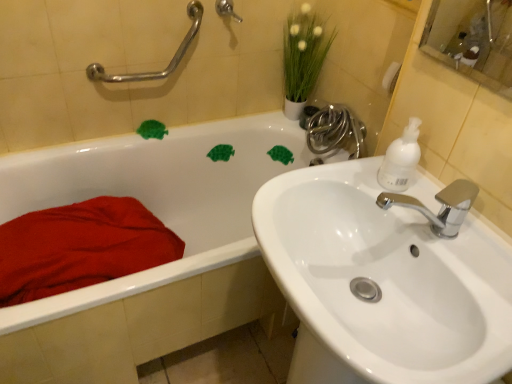
Describe the element at coordinates (382, 283) in the screenshot. I see `white glossy sink at right` at that location.

Identify the location of brushed metal shower handle at upper center, which is the first shower in right-to-left order. (226, 9).

Image resolution: width=512 pixels, height=384 pixels. I want to click on shiny chrome faucet at upper right, so click(x=335, y=131).

Which of these two, white glossy sink at right or red cotton blanket at lower left, is thinner?

With smaller width is red cotton blanket at lower left.

Is white glossy sink at right taller or shorter than red cotton blanket at lower left?

white glossy sink at right is taller than red cotton blanket at lower left.

How many degrees apart are the facing directions of white glossy sink at right and red cotton blanket at lower left?

They differ by 89.2 degrees in their facing directions.

Based on the photo, considering the relative positions of white glossy sink at right and red cotton blanket at lower left in the image provided, is white glossy sink at right to the left of red cotton blanket at lower left from the viewer's perspective?

No, white glossy sink at right is not to the left of red cotton blanket at lower left.

Does white glossy sink at right contain white glossy bathtub at upper left?

No, white glossy sink at right does not contain white glossy bathtub at upper left.

Does white glossy sink at right have a lesser height compared to white glossy bathtub at upper left?

No, white glossy sink at right is not shorter than white glossy bathtub at upper left.

Considering the relative positions of white glossy sink at right and white glossy bathtub at upper left in the image provided, is white glossy sink at right behind white glossy bathtub at upper left?

No, it is not.

Is point (304, 70) closer to viewer compared to point (147, 257)?

That is False.

Would you say green matte plant at upper center is a long distance from red cotton blanket at lower left?

Actually, green matte plant at upper center and red cotton blanket at lower left are a little close together.

Which is behind, green matte plant at upper center or red cotton blanket at lower left?

green matte plant at upper center.

Who is bigger, green matte plant at upper center or red cotton blanket at lower left?

Bigger between the two is red cotton blanket at lower left.

Can you confirm if green matte plant at upper center is wider than white glossy sink at right?

In fact, green matte plant at upper center might be narrower than white glossy sink at right.

Image resolution: width=512 pixels, height=384 pixels. Identify the location of sink that appears below the green matte plant at upper center (from the image's perspective). (382, 283).

Who is taller, green matte plant at upper center or white glossy sink at right?

white glossy sink at right is taller.

Between green matte plant at upper center and white glossy sink at right, which one is positioned in front?

Positioned in front is white glossy sink at right.

Are brushed metal shower handle at upper center, the second shower when ordered from left to right, and shiny chrome faucet at upper right beside each other?

No, brushed metal shower handle at upper center, the second shower when ordered from left to right, is not touching shiny chrome faucet at upper right.

Based on the photo, considering the relative sizes of brushed metal shower handle at upper center, which is the first shower in right-to-left order, and shiny chrome faucet at upper right in the image provided, is brushed metal shower handle at upper center, which is the first shower in right-to-left order, thinner than shiny chrome faucet at upper right?

Correct, the width of brushed metal shower handle at upper center, which is the first shower in right-to-left order, is less than that of shiny chrome faucet at upper right.

Is brushed metal shower handle at upper center, the second shower when ordered from left to right, positioned with its back to shiny chrome faucet at upper right?

brushed metal shower handle at upper center, the second shower when ordered from left to right, does not have its back to shiny chrome faucet at upper right.

Between point (231, 6) and point (314, 150), which one is positioned behind?

The point (314, 150) is behind.

Which of these two, white glossy sink at right or green matte plant at upper center, is wider?

Wider between the two is white glossy sink at right.

Can we say white glossy sink at right lies outside green matte plant at upper center?

Yes, white glossy sink at right is not within green matte plant at upper center.

Is white glossy sink at right further to camera compared to green matte plant at upper center?

No, white glossy sink at right is in front of green matte plant at upper center.

Does point (305, 325) come closer to viewer compared to point (311, 66)?

Yes.

From a real-world perspective, which object stands above the other?

brushed metal shower handle at upper center, the second shower when ordered from left to right, is physically above.

Which object is positioned more to the right, white glossy bathtub at upper left or brushed metal shower handle at upper center, the second shower when ordered from left to right?

Positioned to the right is brushed metal shower handle at upper center, the second shower when ordered from left to right.

Looking at the image, does white glossy bathtub at upper left seem bigger or smaller compared to brushed metal shower handle at upper center, the second shower when ordered from left to right?

white glossy bathtub at upper left is bigger than brushed metal shower handle at upper center, the second shower when ordered from left to right.

From their relative heights in the image, would you say white glossy bathtub at upper left is taller or shorter than brushed metal shower handle at upper center, the second shower when ordered from left to right?

In the image, white glossy bathtub at upper left appears to be taller than brushed metal shower handle at upper center, the second shower when ordered from left to right.

Where is `blanket below the white glossy sink at right (from a real-world perspective)`? This screenshot has width=512, height=384. blanket below the white glossy sink at right (from a real-world perspective) is located at coordinates (80, 247).

You are a GUI agent. You are given a task and a screenshot of the screen. Output one action in this format:
    pyautogui.click(x=<x>, y=<y>)
    Task: Click on the sink in front of the white glossy bathtub at upper left
    The image size is (512, 384).
    Given the screenshot: What is the action you would take?
    pyautogui.click(x=382, y=283)

Consider the image. Considering their positions, is silver metallic grab bar at upper left, placed as the second shower when sorted from right to left, positioned closer to white glossy sink at right than red cotton blanket at lower left?

Among the two, red cotton blanket at lower left is located nearer to white glossy sink at right.

From the image, which object appears to be nearer to white glossy sink at right, green matte plant at upper center or white matte soap dispenser at upper right?

The object closer to white glossy sink at right is white matte soap dispenser at upper right.

Looking at the image, which one is located further to shiny chrome faucet at upper right, green matte plant at upper center or white matte soap dispenser at upper right?

white matte soap dispenser at upper right lies further to shiny chrome faucet at upper right than the other object.

Which object lies further to the anchor point green matte plant at upper center, red cotton blanket at lower left or brushed metal shower handle at upper center, the second shower when ordered from left to right?

red cotton blanket at lower left.

Estimate the real-world distances between objects in this image. Which object is further from brushed metal shower handle at upper center, the second shower when ordered from left to right, green matte plant at upper center or white glossy bathtub at upper left?

Based on the image, white glossy bathtub at upper left appears to be further to brushed metal shower handle at upper center, the second shower when ordered from left to right.

Which object lies further to the anchor point green matte plant at upper center, silver metallic grab bar at upper left, which is the 1th shower in left-to-right order, or brushed metal shower handle at upper center, the second shower when ordered from left to right?

silver metallic grab bar at upper left, which is the 1th shower in left-to-right order, lies further to green matte plant at upper center than the other object.

Based on their spatial positions, is white matte soap dispenser at upper right or white glossy sink at right closer to shiny chrome faucet at upper right?

white matte soap dispenser at upper right is positioned closer to the anchor shiny chrome faucet at upper right.

When comparing their distances from white glossy sink at right, does green matte plant at upper center or shiny chrome faucet at upper right seem further?

Based on the image, green matte plant at upper center appears to be further to white glossy sink at right.

Identify the location of plumbing fixture between brushed metal shower handle at upper center, the second shower when ordered from left to right, and white glossy sink at right vertically. (335, 131).

Identify the location of bathtub between silver metallic grab bar at upper left, which is the 1th shower in left-to-right order, and shiny chrome faucet at upper right from left to right. Image resolution: width=512 pixels, height=384 pixels. (155, 197).

The image size is (512, 384). I want to click on bathtub between silver metallic grab bar at upper left, placed as the second shower when sorted from right to left, and red cotton blanket at lower left from top to bottom, so click(155, 197).

The image size is (512, 384). What are the coordinates of `bathtub between silver metallic grab bar at upper left, placed as the second shower when sorted from right to left, and white glossy sink at right from top to bottom` in the screenshot? It's located at (155, 197).